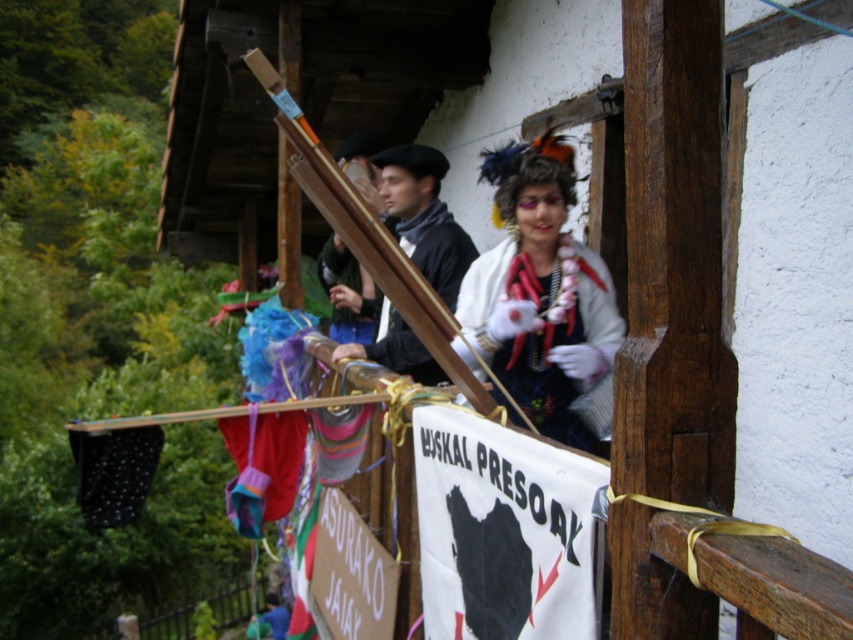
Question: Which of the following is the closest to the observer?

Choices:
 (A) fuzzy white scarf at upper center
 (B) black matte beret at center

Answer: (A)

Question: Is the position of velvet red gloves at center less distant than that of black matte beret at center?

Choices:
 (A) yes
 (B) no

Answer: (A)

Question: Does fuzzy white scarf at upper center appear on the right side of black matte beret at center?

Choices:
 (A) no
 (B) yes

Answer: (B)

Question: Which point is farther to the camera?

Choices:
 (A) (457, 291)
 (B) (373, 330)
 (C) (337, 326)

Answer: (C)

Question: Can you confirm if velvet red gloves at center is positioned to the left of black matte beret at center?

Choices:
 (A) yes
 (B) no

Answer: (B)

Question: Which point appears farthest from the camera in this image?

Choices:
 (A) (345, 260)
 (B) (334, 266)

Answer: (B)